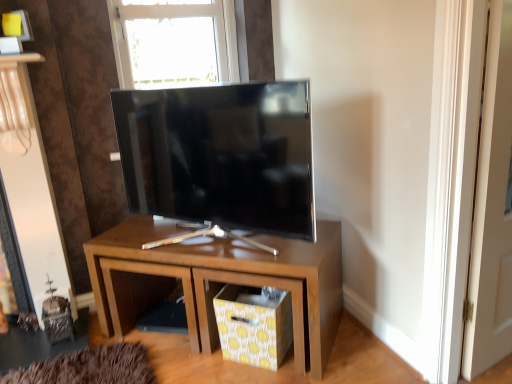
Image resolution: width=512 pixels, height=384 pixels. Identify the location of vacant space that is to the left of yellow dotted fabric drawer at lower center. (198, 361).